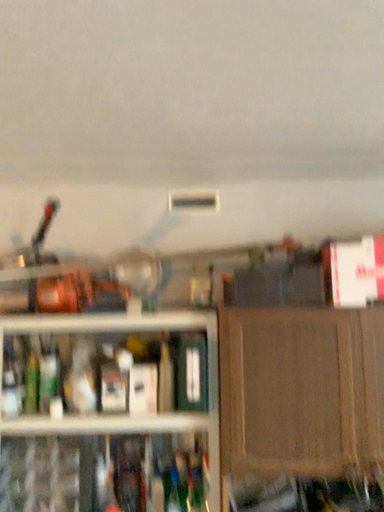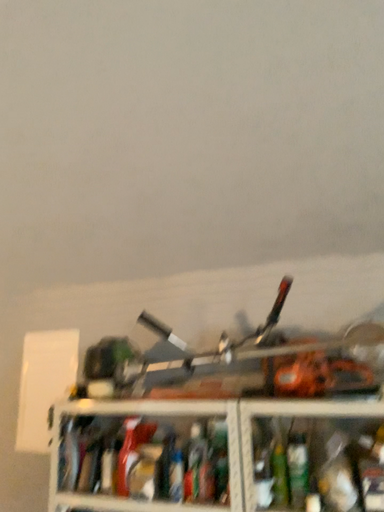
Question: Which way did the camera rotate in the video?

Choices:
 (A) rotated left
 (B) rotated right

Answer: (A)